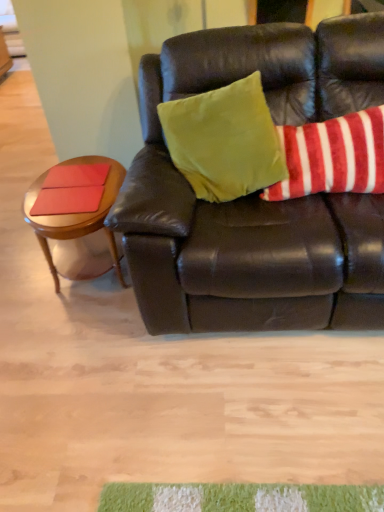
Where is `free space above woodenwoodentable at left (from a real-world perspective)`? This screenshot has height=512, width=384. free space above woodenwoodentable at left (from a real-world perspective) is located at coordinates (80, 190).